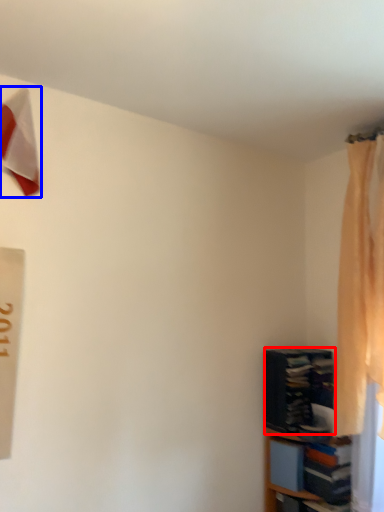
Question: Which of the following is the closest to the observer, book (highlighted by a red box) or twin (highlighted by a blue box)?

Choices:
 (A) book
 (B) twin

Answer: (B)